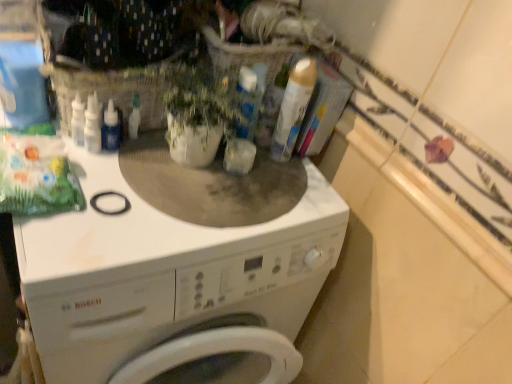
Where is `unoccupied region to the right of transparent plastic bottle at center`? This screenshot has width=512, height=384. unoccupied region to the right of transparent plastic bottle at center is located at coordinates pyautogui.click(x=174, y=179).